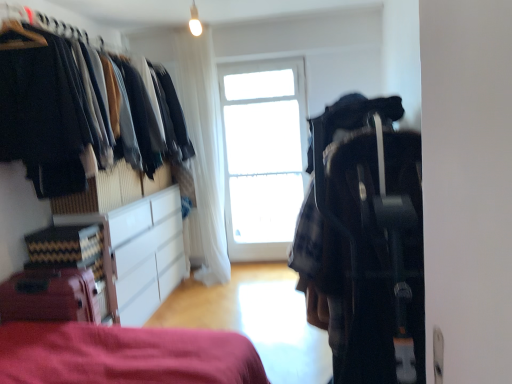
Question: Can you confirm if matte red suitcase at lower left is thinner than plaid fabric backpack at center right?

Choices:
 (A) no
 (B) yes

Answer: (B)

Question: From the image's perspective, is matte red suitcase at lower left over plaid fabric backpack at center right?

Choices:
 (A) no
 (B) yes

Answer: (A)

Question: Is matte red suitcase at lower left outside plaid fabric backpack at center right?

Choices:
 (A) yes
 (B) no

Answer: (A)

Question: Are matte red suitcase at lower left and plaid fabric backpack at center right far apart?

Choices:
 (A) yes
 (B) no

Answer: (A)

Question: Could you tell me if matte red suitcase at lower left is facing plaid fabric backpack at center right?

Choices:
 (A) yes
 (B) no

Answer: (A)

Question: Based on their sizes in the image, would you say white sheer curtain at center is bigger or smaller than transparent glass window at center?

Choices:
 (A) small
 (B) big

Answer: (B)

Question: In the image, is white sheer curtain at center on the left side or the right side of transparent glass window at center?

Choices:
 (A) right
 (B) left

Answer: (B)

Question: Relative to transparent glass window at center, is white sheer curtain at center in front or behind?

Choices:
 (A) front
 (B) behind

Answer: (A)

Question: From their relative heights in the image, would you say white sheer curtain at center is taller or shorter than transparent glass window at center?

Choices:
 (A) tall
 (B) short

Answer: (A)

Question: Is point (84, 269) positioned closer to the camera than point (193, 46)?

Choices:
 (A) closer
 (B) farther

Answer: (A)

Question: Looking at their shapes, would you say matte red suitcase at lower left is wider or thinner than white sheer curtain at center?

Choices:
 (A) wide
 (B) thin

Answer: (A)

Question: From the image's perspective, relative to white sheer curtain at center, is matte red suitcase at lower left above or below?

Choices:
 (A) above
 (B) below

Answer: (B)

Question: Considering their positions, is matte red suitcase at lower left located in front of or behind white sheer curtain at center?

Choices:
 (A) behind
 (B) front

Answer: (B)

Question: From the image's perspective, is matte black clothes at left positioned above or below plaid fabric backpack at center right?

Choices:
 (A) above
 (B) below

Answer: (A)

Question: Considering the relative positions of matte black clothes at left and plaid fabric backpack at center right in the image provided, is matte black clothes at left to the left or to the right of plaid fabric backpack at center right?

Choices:
 (A) left
 (B) right

Answer: (A)